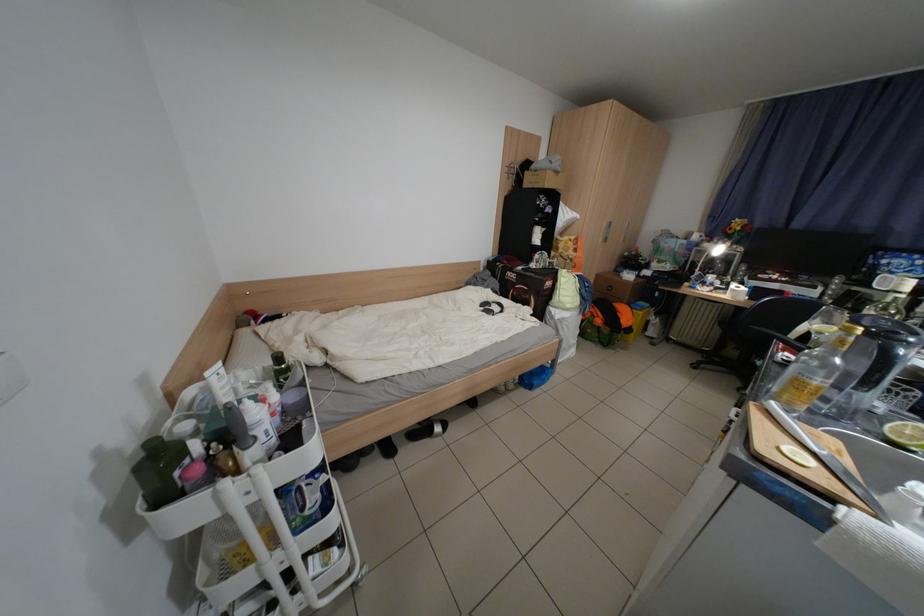
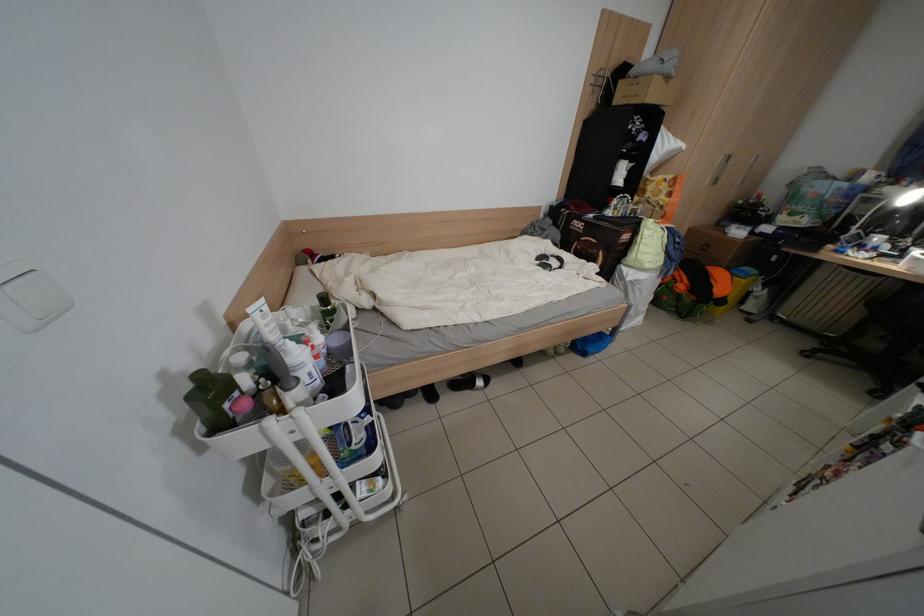
The point at (261, 469) is marked in the first image. Where is the corresponding point in the second image?

(304, 411)